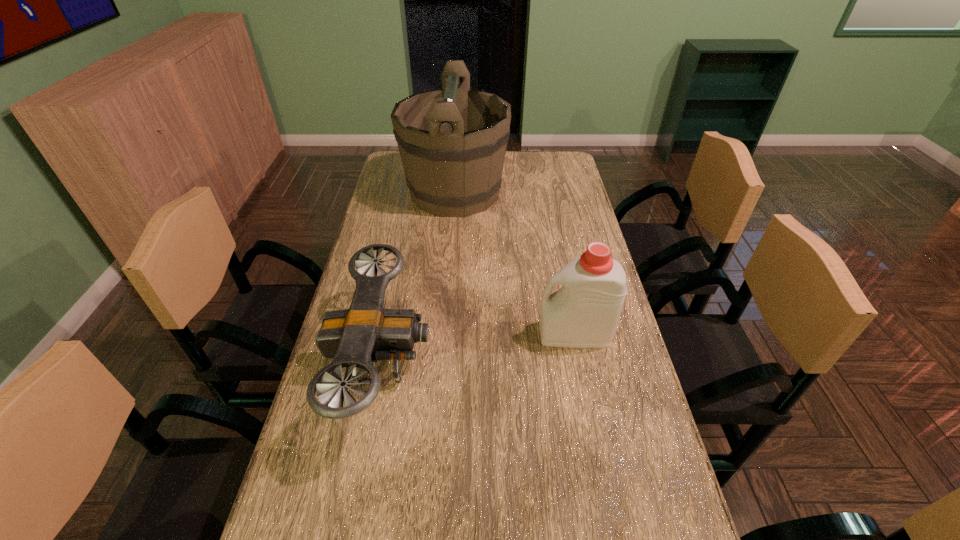
Image resolution: width=960 pixels, height=540 pixels. Identify the location of the tallest object. (452, 141).

At what (x,y) coordinates should I click in order to perform the action: click on bucket. Please return your answer as a coordinate pair (x, y). Image resolution: width=960 pixels, height=540 pixels. Looking at the image, I should click on (452, 141).

Image resolution: width=960 pixels, height=540 pixels. In order to click on the second shortest object in this screenshot , I will do `click(584, 312)`.

Identify the location of detergent. 584,312.

You are a GUI agent. You are given a task and a screenshot of the screen. Output one action in this format:
    pyautogui.click(x=<x>, y=<y>)
    Task: Click on the shortest object
    This screenshot has width=960, height=540.
    Given the screenshot: What is the action you would take?
    pyautogui.click(x=357, y=337)

What are the coordinates of `vacant area situated on the front of the bucket` in the screenshot? It's located at (447, 292).

This screenshot has height=540, width=960. Identify the location of vacant space located 0.400m on the handle side of the detergent. (388, 334).

In order to click on free region located on the handle side of the detergent in this screenshot , I will do `click(504, 334)`.

You are a GUI agent. You are given a task and a screenshot of the screen. Output one action in this format:
    pyautogui.click(x=<x>, y=<y>)
    Task: Click on the vacant space located on the handle side of the detergent
    
    Given the screenshot: What is the action you would take?
    pyautogui.click(x=463, y=334)

Identify the location of vacant region located on the front-facing side of the shortest object. (528, 363).